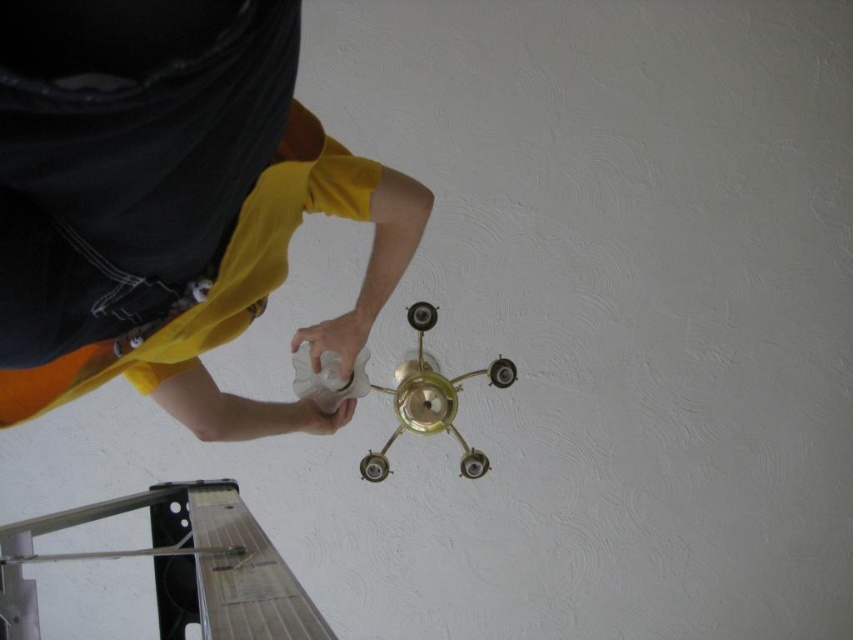
You are standing directly below the gold metallic chandelier at center. If you move 0.3 meters to the left, will you still be under the chandelier?

The gold metallic chandelier at center is located at point [431,400]. Moving 0.3 meters to the left would take you out from under the chandelier since the coordinates indicate its central position.

You are a safety inspector checking the workspace. You notice the yellow matte shirt at upper center and the white matte bottle at center. Which object is positioned closer to your viewpoint?

The yellow matte shirt at upper center is closer to the viewer than the white matte bottle at center.